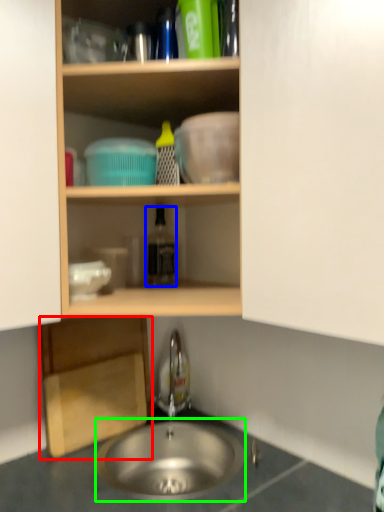
Question: Considering the real-world distances, which object is closest to cabinetry (highlighted by a red box)? bottle (highlighted by a blue box) or sink (highlighted by a green box).

Choices:
 (A) bottle
 (B) sink

Answer: (B)